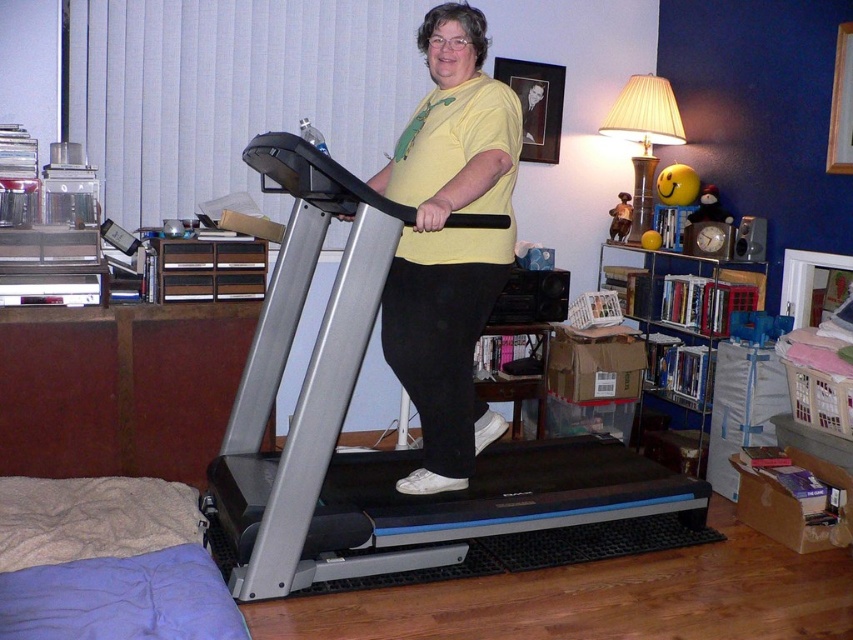
Question: Can you confirm if yellow matte shirt at center is thinner than metallic silver bookshelf at right?

Choices:
 (A) yes
 (B) no

Answer: (A)

Question: Does silver metallic treadmill at center appear under yellow matte shirt at center?

Choices:
 (A) yes
 (B) no

Answer: (A)

Question: Among these points, which one is nearest to the camera?

Choices:
 (A) (474, 84)
 (B) (654, 284)
 (C) (523, 483)

Answer: (A)

Question: Which point appears farthest from the camera in this image?

Choices:
 (A) (648, 250)
 (B) (316, 580)

Answer: (A)

Question: Which of these objects is positioned closest to the silver metallic treadmill at center?

Choices:
 (A) yellow matte shirt at center
 (B) metallic silver bookshelf at right

Answer: (A)

Question: Does silver metallic treadmill at center appear on the right side of yellow matte shirt at center?

Choices:
 (A) no
 (B) yes

Answer: (A)